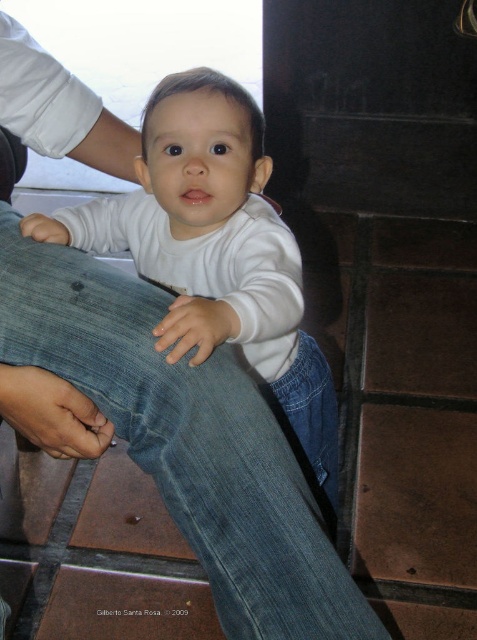
Question: Does denim jeans at lower left have a lesser width compared to white matte shirt at center?

Choices:
 (A) no
 (B) yes

Answer: (B)

Question: Which of the following is the closest to the observer?

Choices:
 (A) white matte shirt at center
 (B) denim jeans at lower left

Answer: (B)

Question: Does denim jeans at lower left appear on the right side of white matte shirt at center?

Choices:
 (A) yes
 (B) no

Answer: (B)

Question: Which object appears farthest from the camera in this image?

Choices:
 (A) white matte shirt at center
 (B) denim jeans at lower left

Answer: (A)

Question: Which object is farther from the camera taking this photo?

Choices:
 (A) white matte shirt at center
 (B) denim jeans at lower left

Answer: (A)

Question: Is denim jeans at lower left wider than white matte shirt at center?

Choices:
 (A) no
 (B) yes

Answer: (A)